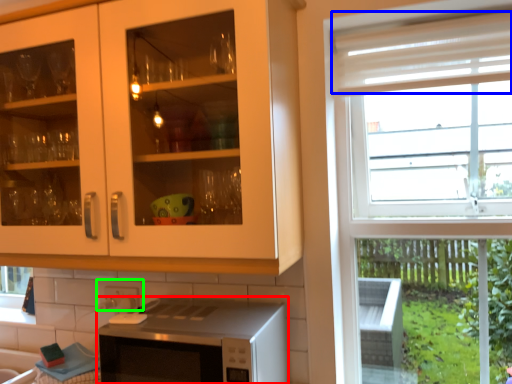
Question: Which object is the closest to the microwave oven (highlighted by a red box)? Choose among these: curtain (highlighted by a blue box) or tile (highlighted by a green box).

Choices:
 (A) curtain
 (B) tile

Answer: (B)